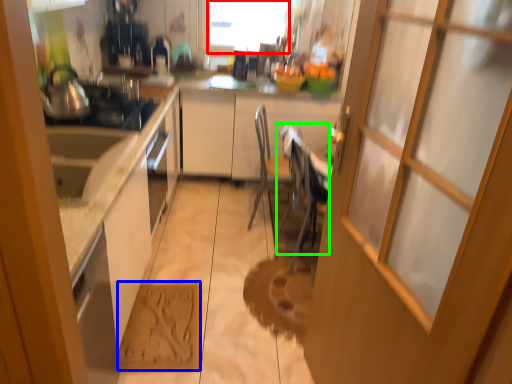
Question: Estimate the real-world distances between objects in this image. Which object is farther from window screen (highlighted by a red box), cardboard (highlighted by a blue box) or chair (highlighted by a green box)?

Choices:
 (A) cardboard
 (B) chair

Answer: (A)